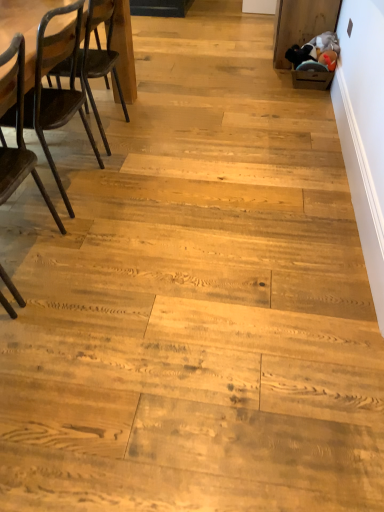
I want to click on dark brown wood chair at left, marked as the first chair in a back-to-front arrangement, so click(x=58, y=88).

What is the approximate height of dark brown wood chair at left, positioned as the 2th chair in front-to-back order?

dark brown wood chair at left, positioned as the 2th chair in front-to-back order, is 35.75 inches tall.

Describe the element at coordinates (25, 27) in the screenshot. I see `dark brown wood table at left` at that location.

What is the approximate width of dark brown wood chair at left, the 2th chair viewed from the back?

It is 15.68 inches.

What are the coordinates of `dark brown wood chair at left, positioned as the 2th chair in front-to-back order` in the screenshot? It's located at (58, 88).

Is dark brown wood chair at left, the 2th chair viewed from the back, oriented away from dark brown wood table at left?

That's not correct — dark brown wood chair at left, the 2th chair viewed from the back, is not looking away from dark brown wood table at left.

Based on their positions, is dark brown wood chair at left, the 1th chair viewed from the front, located to the left or right of dark brown wood table at left?

Based on their positions, dark brown wood chair at left, the 1th chair viewed from the front, is located to the left of dark brown wood table at left.

Considering the points (13, 152) and (120, 14), which point is behind, point (13, 152) or point (120, 14)?

The point (120, 14) is behind.

Is dark brown wood chair at left, the 2th chair viewed from the back, far away from dark brown wood table at left?

Absolutely, dark brown wood chair at left, the 2th chair viewed from the back, is distant from dark brown wood table at left.

From a real-world perspective, does dark brown wood table at left stand above dark brown wood chair at left, marked as the first chair in a back-to-front arrangement?

Actually, dark brown wood table at left is physically below dark brown wood chair at left, marked as the first chair in a back-to-front arrangement, in the real world.

Is dark brown wood table at left positioned beyond the bounds of dark brown wood chair at left, positioned as the 2th chair in front-to-back order?

That's correct, dark brown wood table at left is outside of dark brown wood chair at left, positioned as the 2th chair in front-to-back order.

Does dark brown wood table at left lie in front of dark brown wood chair at left, positioned as the 2th chair in front-to-back order?

No.

Between dark brown wood table at left and dark brown wood chair at left, positioned as the 2th chair in front-to-back order, which one has larger size?

dark brown wood chair at left, positioned as the 2th chair in front-to-back order, is bigger.

From a real-world perspective, who is located higher, dark brown wood table at left or dark brown wood chair at left, the 2th chair viewed from the back?

In real-world perspective, dark brown wood chair at left, the 2th chair viewed from the back, is above.

Is point (121, 56) positioned behind point (25, 177)?

Yes, point (121, 56) is farther from viewer.

Consider the image. Considering the sizes of objects dark brown wood table at left and dark brown wood chair at left, the 2th chair viewed from the back, in the image provided, who is shorter, dark brown wood table at left or dark brown wood chair at left, the 2th chair viewed from the back,?

Standing shorter between the two is dark brown wood table at left.

Which of these two, dark brown wood chair at left, the 1th chair viewed from the front, or dark brown wood chair at left, positioned as the 2th chair in front-to-back order, is wider?

dark brown wood chair at left, positioned as the 2th chair in front-to-back order.

Is dark brown wood chair at left, positioned as the 2th chair in front-to-back order, at the back of dark brown wood chair at left, the 2th chair viewed from the back?

dark brown wood chair at left, the 2th chair viewed from the back, is not turned away from dark brown wood chair at left, positioned as the 2th chair in front-to-back order.

Between dark brown wood chair at left, the 1th chair viewed from the front, and dark brown wood chair at left, marked as the first chair in a back-to-front arrangement, which one has larger size?

dark brown wood chair at left, marked as the first chair in a back-to-front arrangement.

How distant is dark brown wood chair at left, positioned as the 2th chair in front-to-back order, from dark brown wood table at left?

The distance of dark brown wood chair at left, positioned as the 2th chair in front-to-back order, from dark brown wood table at left is 27.46 inches.

At what (x,y) coordinates should I click in order to perform the action: click on table above the dark brown wood chair at left, marked as the first chair in a back-to-front arrangement (from the image's perspective). Please return your answer as a coordinate pair (x, y). The image size is (384, 512). Looking at the image, I should click on (25, 27).

Does point (27, 109) come farther from viewer compared to point (122, 42)?

No, it is in front of (122, 42).

Does dark brown wood chair at left, positioned as the 2th chair in front-to-back order, have a greater height compared to dark brown wood table at left?

Yes, dark brown wood chair at left, positioned as the 2th chair in front-to-back order, is taller than dark brown wood table at left.

Is dark brown wood chair at left, marked as the first chair in a back-to-front arrangement, beside dark brown wood chair at left, the 2th chair viewed from the back?

No, dark brown wood chair at left, marked as the first chair in a back-to-front arrangement, is not with dark brown wood chair at left, the 2th chair viewed from the back.

Is dark brown wood chair at left, positioned as the 2th chair in front-to-back order, positioned with its back to dark brown wood chair at left, the 2th chair viewed from the back?

No.

Between point (31, 106) and point (60, 223), which one is positioned behind?

The point (60, 223) is farther.

Choose the correct answer: Is dark brown wood chair at left, marked as the first chair in a back-to-front arrangement, inside dark brown wood chair at left, the 2th chair viewed from the back, or outside it?

dark brown wood chair at left, marked as the first chair in a back-to-front arrangement, exists outside the volume of dark brown wood chair at left, the 2th chair viewed from the back.

The image size is (384, 512). I want to click on the 2nd chair counting from the left of the dark brown wood table at left, so click(18, 131).

Where is `the 1st chair in front of the dark brown wood table at left, starting your count from the anchor`? The width and height of the screenshot is (384, 512). the 1st chair in front of the dark brown wood table at left, starting your count from the anchor is located at coordinates (58, 88).

Estimate the real-world distances between objects in this image. Which object is closer to dark brown wood chair at left, the 2th chair viewed from the back, dark brown wood table at left or dark brown wood chair at left, positioned as the 2th chair in front-to-back order?

Based on the image, dark brown wood chair at left, positioned as the 2th chair in front-to-back order, appears to be nearer to dark brown wood chair at left, the 2th chair viewed from the back.

In the scene shown: Considering their positions, is dark brown wood chair at left, positioned as the 2th chair in front-to-back order, positioned closer to dark brown wood chair at left, the 2th chair viewed from the back, than dark brown wood table at left?

The object closer to dark brown wood chair at left, the 2th chair viewed from the back, is dark brown wood chair at left, positioned as the 2th chair in front-to-back order.

From the image, which object appears to be nearer to dark brown wood chair at left, positioned as the 2th chair in front-to-back order, dark brown wood chair at left, the 2th chair viewed from the back, or dark brown wood table at left?

dark brown wood chair at left, the 2th chair viewed from the back, lies closer to dark brown wood chair at left, positioned as the 2th chair in front-to-back order, than the other object.

When comparing their distances from dark brown wood table at left, does dark brown wood chair at left, marked as the first chair in a back-to-front arrangement, or dark brown wood chair at left, the 2th chair viewed from the back, seem further?

Among the two, dark brown wood chair at left, the 2th chair viewed from the back, is located further to dark brown wood table at left.

Considering their positions, is dark brown wood chair at left, the 1th chair viewed from the front, positioned closer to dark brown wood table at left than dark brown wood chair at left, marked as the first chair in a back-to-front arrangement?

Among the two, dark brown wood chair at left, marked as the first chair in a back-to-front arrangement, is located nearer to dark brown wood table at left.

Based on their spatial positions, is dark brown wood table at left or dark brown wood chair at left, the 1th chair viewed from the front, further from dark brown wood chair at left, positioned as the 2th chair in front-to-back order?

dark brown wood table at left lies further to dark brown wood chair at left, positioned as the 2th chair in front-to-back order, than the other object.

This screenshot has width=384, height=512. I want to click on chair positioned between dark brown wood chair at left, the 1th chair viewed from the front, and dark brown wood table at left from near to far, so click(x=58, y=88).